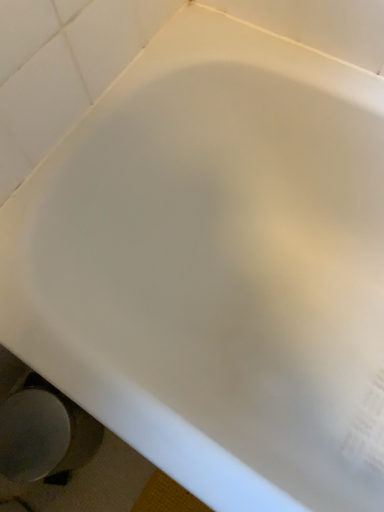
Find the location of a particular element. This screenshot has height=512, width=384. blank space above satin silver bidet at lower left (from a real-world perspective) is located at coordinates (28, 430).